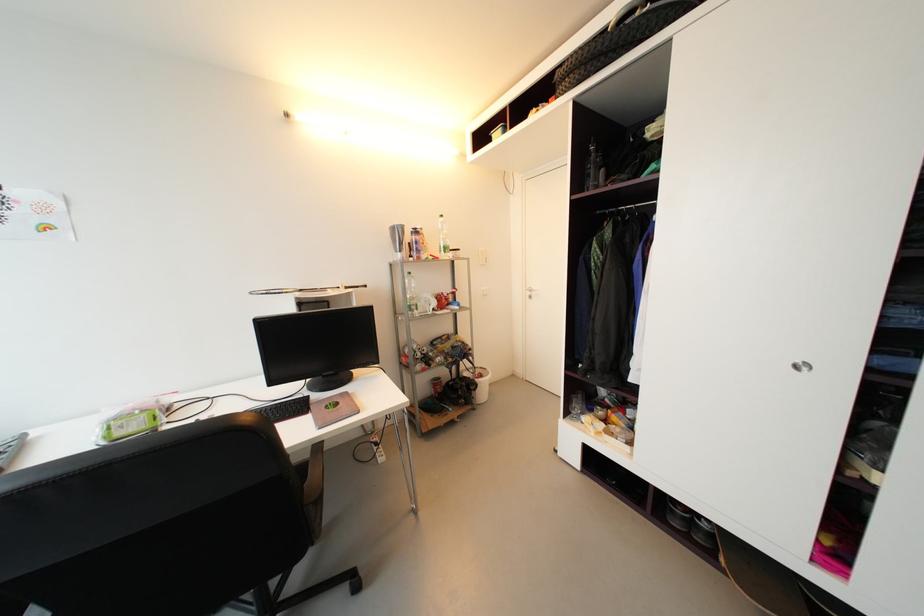
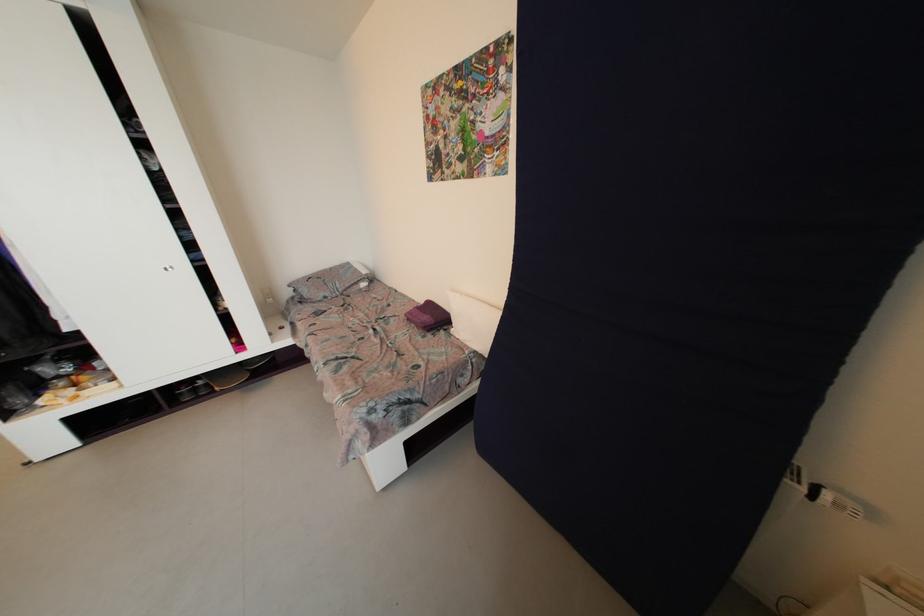
Find the pixel in the second image that matches pixel 716 538 in the first image.

(212, 387)